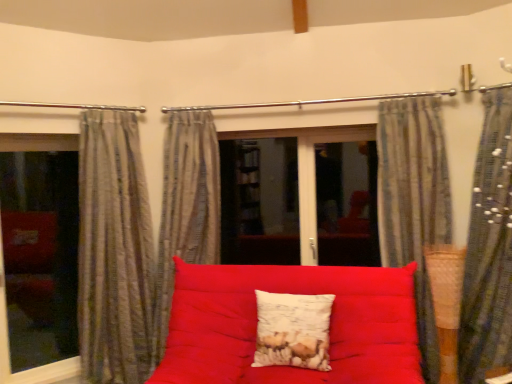
Question: Can we say striped fabric curtain at right, the fourth curtain from the left, lies outside white textured pillow at center?

Choices:
 (A) no
 (B) yes

Answer: (B)

Question: Does striped fabric curtain at right, which appears as the 1th curtain when viewed from the right, have a larger size compared to white textured pillow at center?

Choices:
 (A) no
 (B) yes

Answer: (B)

Question: Does striped fabric curtain at right, which appears as the 1th curtain when viewed from the right, touch white textured pillow at center?

Choices:
 (A) no
 (B) yes

Answer: (A)

Question: Can you confirm if striped fabric curtain at right, which appears as the 1th curtain when viewed from the right, is positioned to the right of white textured pillow at center?

Choices:
 (A) no
 (B) yes

Answer: (B)

Question: Is striped fabric curtain at right, which appears as the 1th curtain when viewed from the right, looking in the opposite direction of white textured pillow at center?

Choices:
 (A) no
 (B) yes

Answer: (A)

Question: From the image's perspective, relative to transparent glass window at left, is striped fabric curtain at center, which is the 3th curtain in right-to-left order, above or below?

Choices:
 (A) below
 (B) above

Answer: (B)

Question: Is striped fabric curtain at center, which is the 3th curtain in right-to-left order, inside the boundaries of transparent glass window at left, or outside?

Choices:
 (A) inside
 (B) outside

Answer: (B)

Question: Visually, is striped fabric curtain at center, the 2th curtain from the left, positioned to the left or to the right of transparent glass window at left?

Choices:
 (A) right
 (B) left

Answer: (A)

Question: Is striped fabric curtain at center, the 2th curtain from the left, bigger or smaller than transparent glass window at left?

Choices:
 (A) small
 (B) big

Answer: (B)

Question: Is point (443, 89) positioned closer to the camera than point (394, 241)?

Choices:
 (A) farther
 (B) closer

Answer: (A)

Question: In terms of height, does metallic rod at upper center look taller or shorter compared to striped fabric curtain at upper right, placed as the 3th curtain when sorted from left to right?

Choices:
 (A) short
 (B) tall

Answer: (A)

Question: Which is correct: metallic rod at upper center is inside striped fabric curtain at upper right, the 2th curtain in the right-to-left sequence, or outside of it?

Choices:
 (A) outside
 (B) inside

Answer: (A)

Question: Based on their positions, is metallic rod at upper center located to the left or right of striped fabric curtain at upper right, the 2th curtain in the right-to-left sequence?

Choices:
 (A) left
 (B) right

Answer: (A)

Question: From a real-world perspective, relative to matte red fabric studio couch at center, is striped fabric curtain at right, which appears as the 1th curtain when viewed from the right, vertically above or below?

Choices:
 (A) below
 (B) above

Answer: (B)

Question: From their relative heights in the image, would you say striped fabric curtain at right, the fourth curtain from the left, is taller or shorter than matte red fabric studio couch at center?

Choices:
 (A) tall
 (B) short

Answer: (A)